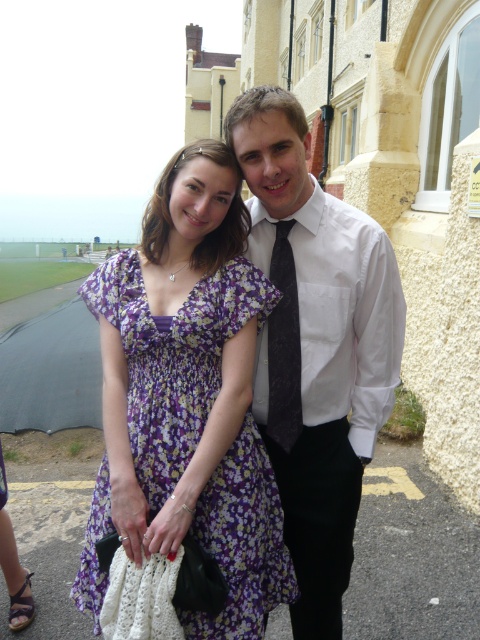
You are a photographer adjusting the lighting for a portrait. You notice the white smooth shirt at center and the dark gray textured tie at center. Which item requires more space in the frame to capture its full width?

The white smooth shirt at center requires more space in the frame because its width is larger than the dark gray textured tie at center.

You are a photographer trying to frame a shot of the white smooth shirt at center and the floral fabric dress at center. Which object should you focus on first if you want to capture the larger one in the frame?

The white smooth shirt at center is larger in size than the floral fabric dress at center, so you should focus on the white smooth shirt at center first to capture the larger one in the frame.